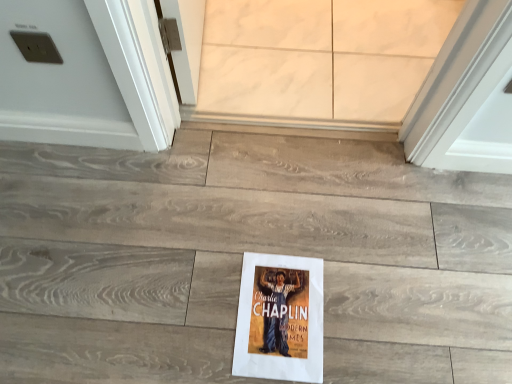
I want to click on free space above white paper flyer at center (from a real-world perspective), so click(275, 310).